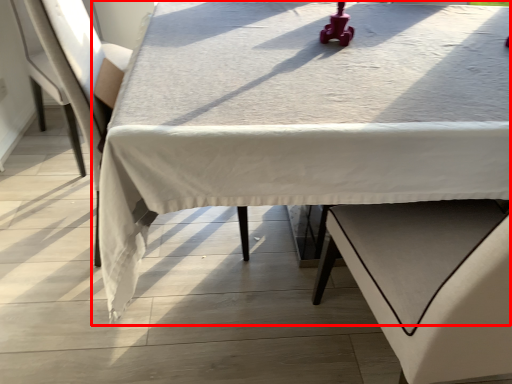
Question: From the image's perspective, what is the correct spatial relationship of table (annotated by the red box) in relation to armchair?

Choices:
 (A) below
 (B) above

Answer: (A)